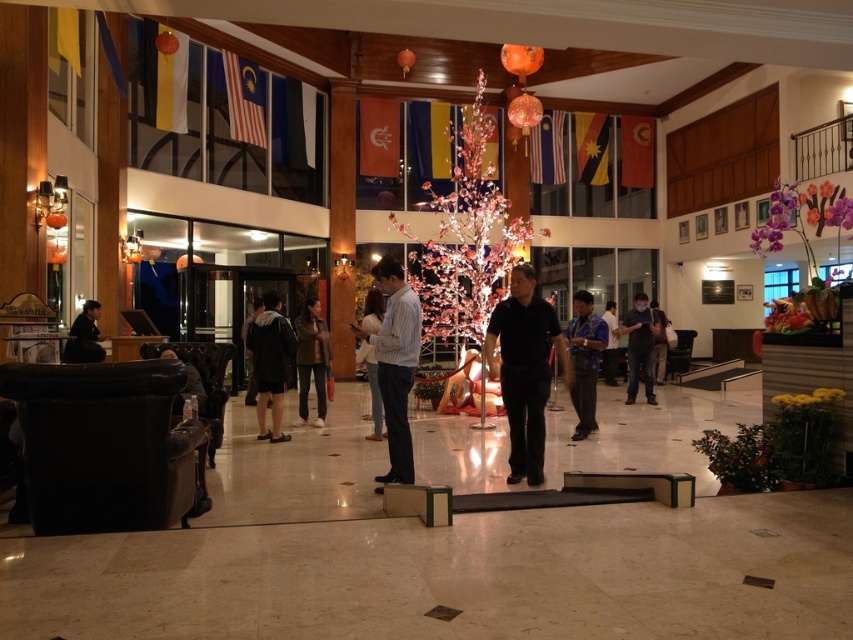
You are a photographer positioned at the entrance of the building. You need to capture a photo that includes both the blue patterned shirt at center and the blue fabric shirt at center. Which one should you focus on first to ensure both are in frame?

The blue patterned shirt at center is much taller than the blue fabric shirt at center, so you should focus on the blue patterned shirt at center first to ensure both are in frame.

You are standing at point (366,378) and want to walk to the reception desk located at point (590,420). Is the reception desk in front of you or behind you?

The point (590,420) is in front of point (366,378), so the reception desk is in front of you.